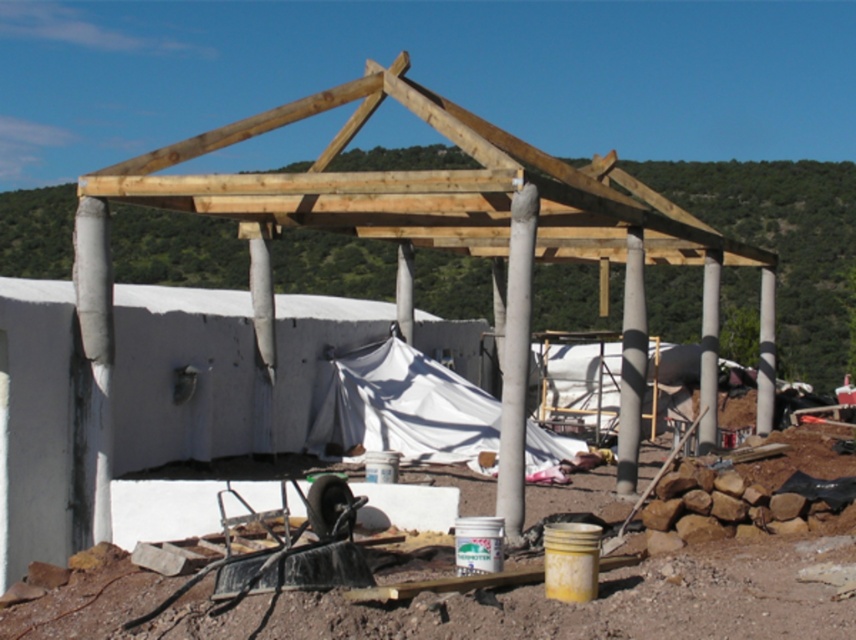
You are an engineer inspecting the construction site shown in the image. You need to determine which of the two poles at the center is more suitable for a load that requires a thicker support. Based on the poles labeled as smooth concrete pole at center and gray concrete pole at center, which one should you choose?

The gray concrete pole at center is thicker than the smooth concrete pole at center, so it is more suitable for supporting heavier loads.

You are a construction worker standing at the entrance of the construction site. You need to place a 30 feet long steel beam from the entrance to the smooth concrete pole at center. Can you safely transport the beam without it hitting any obstacles?

The smooth concrete pole at center is 33.78 feet away from the viewer. Since the beam is 30 feet long, it can be safely transported as the distance is sufficient to accommodate the beam without obstruction.